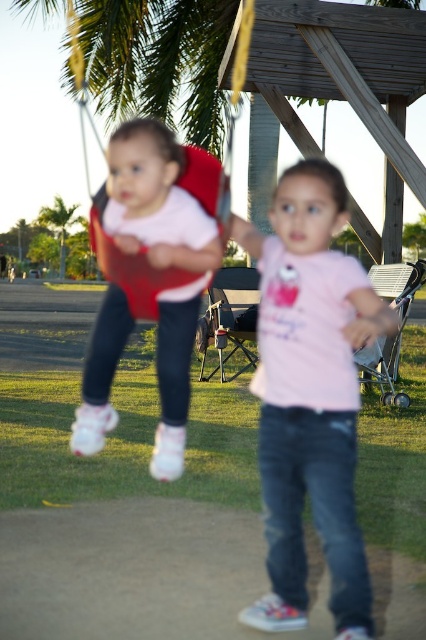
Between point (365, 291) and point (233, 125), which one is positioned behind?

The point (233, 125) is more distant.

Is pink matte shirt at center wider than red fabric swing at left?

In fact, pink matte shirt at center might be narrower than red fabric swing at left.

Is point (340, 584) farther from camera compared to point (124, 266)?

No.

You are a GUI agent. You are given a task and a screenshot of the screen. Output one action in this format:
    pyautogui.click(x=<x>, y=<y>)
    Task: Click on the pink matte shirt at center
    The height and width of the screenshot is (640, 426).
    Given the screenshot: What is the action you would take?
    pyautogui.click(x=310, y=396)

Who is higher up, matte pink shirt at left or red fabric swing at left?

red fabric swing at left is above.

Does point (150, 177) lie in front of point (140, 253)?

That is True.

The image size is (426, 640). Describe the element at coordinates (149, 276) in the screenshot. I see `matte pink shirt at left` at that location.

At what (x,y) coordinates should I click in order to perform the action: click on matte pink shirt at left. Please return your answer as a coordinate pair (x, y). The width and height of the screenshot is (426, 640). Looking at the image, I should click on (149, 276).

This screenshot has height=640, width=426. What do you see at coordinates (310, 396) in the screenshot?
I see `pink matte shirt at center` at bounding box center [310, 396].

Does pink matte shirt at center appear on the left side of green leafy palm tree at upper left?

Incorrect, pink matte shirt at center is not on the left side of green leafy palm tree at upper left.

Where is `pink matte shirt at center`? The image size is (426, 640). pink matte shirt at center is located at coordinates (310, 396).

This screenshot has height=640, width=426. What are the coordinates of `pink matte shirt at center` in the screenshot? It's located at (310, 396).